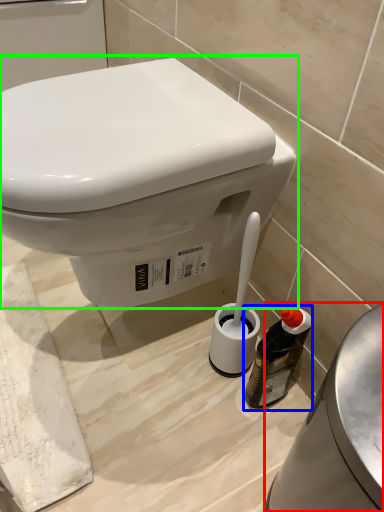
Question: Estimate the real-world distances between objects in this image. Which object is farther from porcelain (highlighted by a red box), bottle (highlighted by a blue box) or toilet (highlighted by a green box)?

Choices:
 (A) bottle
 (B) toilet

Answer: (B)